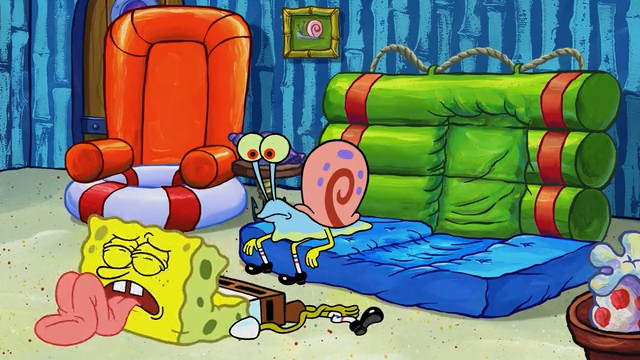
This screenshot has width=640, height=360. Identify the location of bed. tap(438, 286).